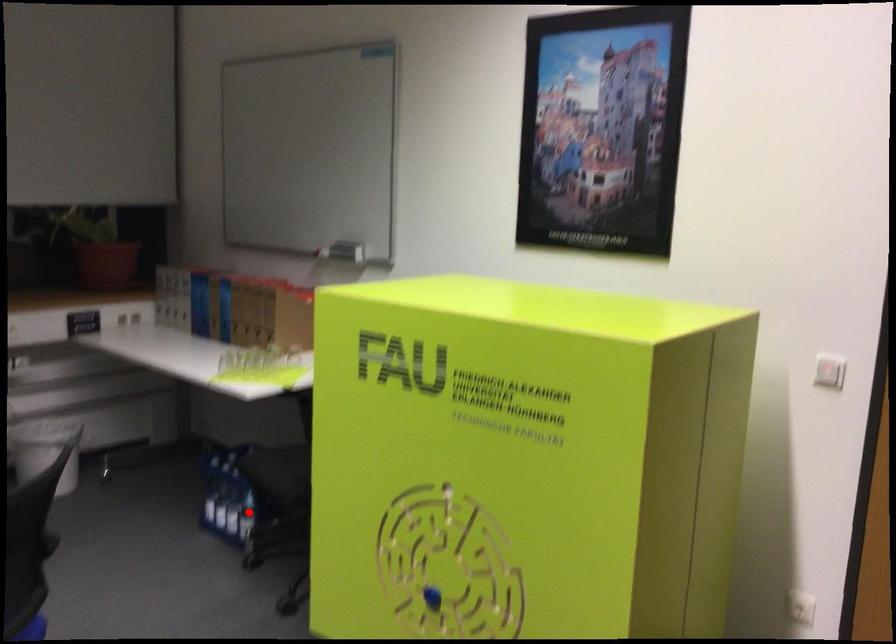
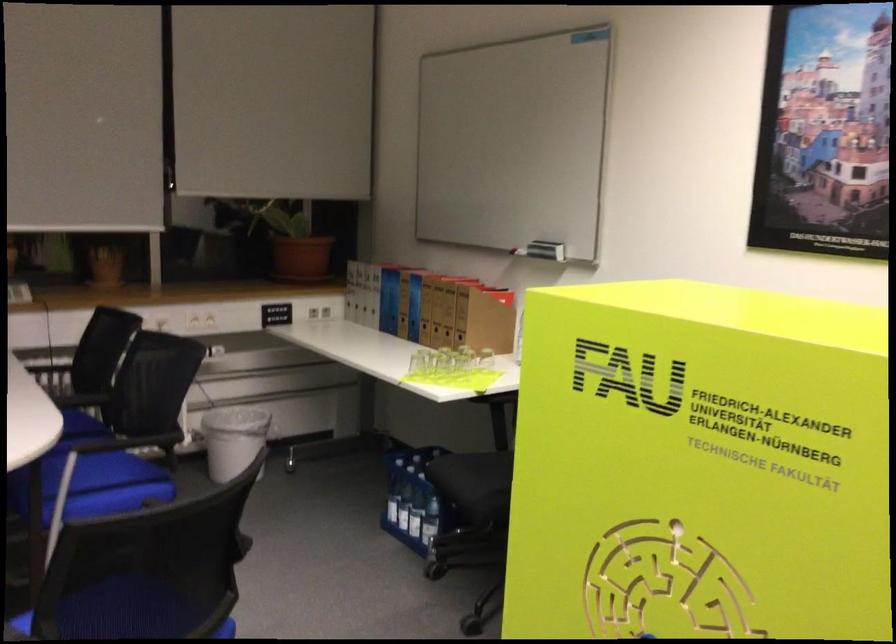
Find the pixel in the second image that matches the highlighted location in the first image.

(429, 520)